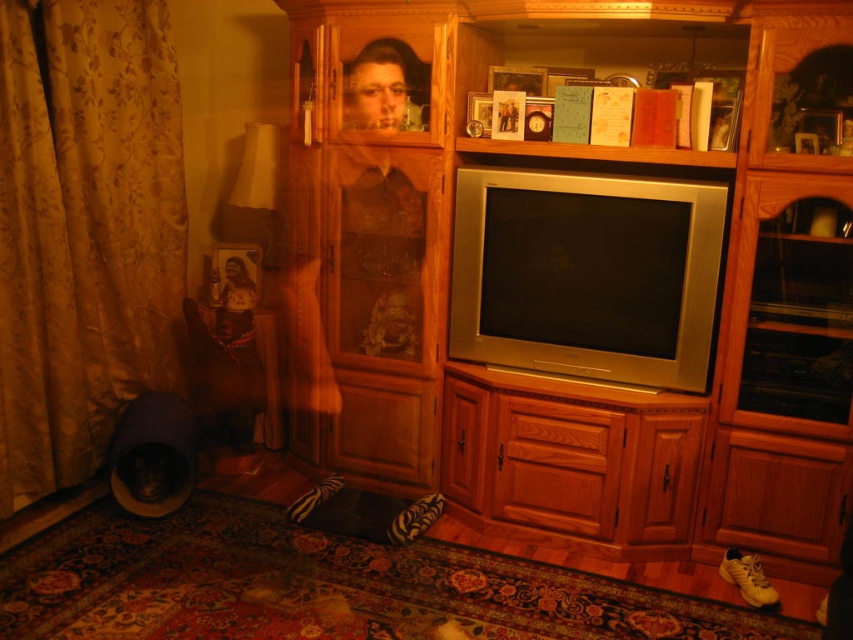
Is point (463, 323) behind point (137, 262)?

No, it is not.

Consider the image. Is wooden entertainment center at center above gold fabric curtain at left?

No.

Where is `wooden entertainment center at center`? wooden entertainment center at center is located at coordinates (585, 273).

The image size is (853, 640). Identify the location of wooden entertainment center at center. (585, 273).